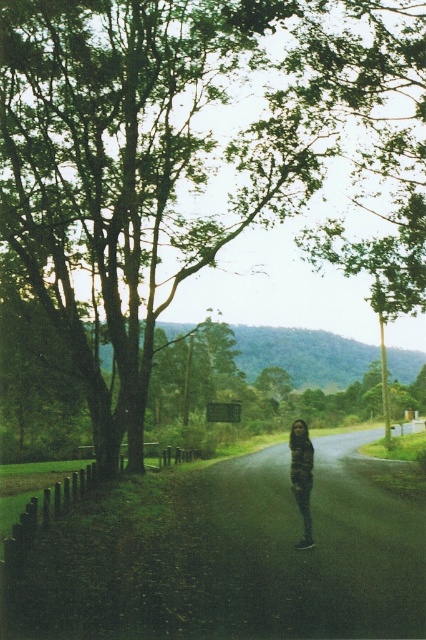
Question: Is the position of green leafy tree at center more distant than that of dark asphalt road at center?

Choices:
 (A) no
 (B) yes

Answer: (B)

Question: From the image, what is the correct spatial relationship of green leafy tree at center in relation to dark asphalt road at center?

Choices:
 (A) left
 (B) right

Answer: (B)

Question: Does dark asphalt road at center come in front of dark brown leather jacket at center?

Choices:
 (A) no
 (B) yes

Answer: (B)

Question: Which object is positioned farthest from the dark brown leather jacket at center?

Choices:
 (A) green leafy tree at center
 (B) dark asphalt road at center

Answer: (A)

Question: Which of the following is the farthest from the observer?

Choices:
 (A) dark asphalt road at center
 (B) green leafy tree at center
 (C) dark brown leather jacket at center

Answer: (B)

Question: Among these points, which one is nearest to the camera?

Choices:
 (A) (294, 568)
 (B) (129, 88)
 (C) (293, 486)

Answer: (A)